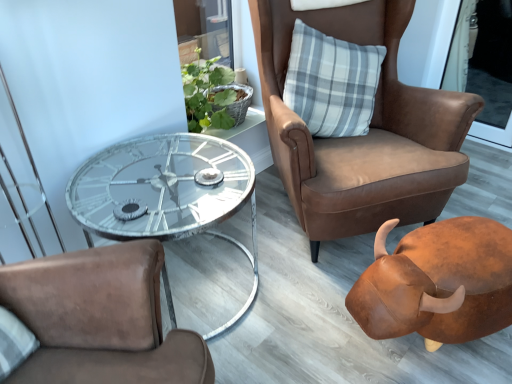
The image size is (512, 384). Describe the element at coordinates (364, 136) in the screenshot. I see `brown leather chair at upper right` at that location.

The height and width of the screenshot is (384, 512). In order to click on gray plaid pillow at upper right in this screenshot , I will do `click(332, 82)`.

Identify the location of transparent plastic screen door at upper right. Image resolution: width=512 pixels, height=384 pixels. (461, 48).

Which point is more distant from viewer, (195, 136) or (456, 90)?

The point (456, 90) is farther from the camera.

From a real-world perspective, between metallic glass coffee table at center and transparent plastic screen door at upper right, who is vertically higher?

In real-world perspective, transparent plastic screen door at upper right is above.

Does metallic glass coffee table at center turn towards transparent plastic screen door at upper right?

No, metallic glass coffee table at center is not turned towards transparent plastic screen door at upper right.

Which is behind, point (387, 332) or point (254, 280)?

The point (254, 280) is farther.

Locate an element on the screen. The height and width of the screenshot is (384, 512). piggy bank that is under the metallic glass coffee table at center (from a real-world perspective) is located at coordinates (437, 283).

Does brown leather piggy bank at lower right appear on the right side of metallic glass coffee table at center?

Correct, you'll find brown leather piggy bank at lower right to the right of metallic glass coffee table at center.

Is brown leather piggy bank at lower right positioned behind metallic glass coffee table at center?

Yes, it is.

Who is bigger, brown leather chair at upper right or gray plaid pillow at upper right?

Bigger between the two is brown leather chair at upper right.

Are brown leather chair at upper right and gray plaid pillow at upper right making contact?

No, brown leather chair at upper right is not making contact with gray plaid pillow at upper right.

Considering the relative positions of brown leather chair at upper right and gray plaid pillow at upper right in the image provided, is brown leather chair at upper right behind gray plaid pillow at upper right?

No.

Looking at their sizes, would you say brown leather chair at upper right is wider or thinner than gray plaid pillow at upper right?

Considering their sizes, brown leather chair at upper right looks broader than gray plaid pillow at upper right.

Image resolution: width=512 pixels, height=384 pixels. What are the coordinates of `screen door behind the metallic glass coffee table at center` in the screenshot? It's located at coord(461,48).

Can you tell me how much transparent plastic screen door at upper right and metallic glass coffee table at center differ in facing direction?

There is a 89.5-degree angle between the facing directions of transparent plastic screen door at upper right and metallic glass coffee table at center.

Which is behind, point (462, 11) or point (97, 225)?

Positioned behind is point (462, 11).

Is transparent plastic screen door at upper right behind metallic glass coffee table at center?

Yes, transparent plastic screen door at upper right is further from the viewer.

Considering the positions of objects gray plaid pillow at upper right and brown leather chair at upper right in the image provided, who is more to the right, gray plaid pillow at upper right or brown leather chair at upper right?

Positioned to the right is brown leather chair at upper right.

Would you say gray plaid pillow at upper right is a long distance from brown leather chair at upper right?

No, there isn't a large distance between gray plaid pillow at upper right and brown leather chair at upper right.

Is point (312, 120) closer or farther from the camera than point (355, 169)?

Clearly, point (312, 120) is more distant from the camera than point (355, 169).

In terms of height, does gray plaid pillow at upper right look taller or shorter compared to brown leather chair at upper right?

In the image, gray plaid pillow at upper right appears to be shorter than brown leather chair at upper right.

Between brown leather piggy bank at lower right and gray plaid pillow at upper right, which one has less height?

brown leather piggy bank at lower right is shorter.

From the picture: Considering the relative sizes of brown leather piggy bank at lower right and gray plaid pillow at upper right in the image provided, is brown leather piggy bank at lower right smaller than gray plaid pillow at upper right?

Yes.

Is point (419, 234) closer or farther from the camera than point (375, 56)?

Point (419, 234) is positioned closer to the camera compared to point (375, 56).

Looking at this image, is brown leather piggy bank at lower right placed right next to gray plaid pillow at upper right?

No, brown leather piggy bank at lower right is not with gray plaid pillow at upper right.

Is brown leather chair at upper right looking in the opposite direction of metallic glass coffee table at center?

No.

What are the coordinates of `chair on the right of metallic glass coffee table at center` in the screenshot? It's located at pos(364,136).

Which is closer to the camera, (328, 187) or (136, 222)?

The point (136, 222) is more forward.

Is brown leather chair at upper right positioned beyond the bounds of metallic glass coffee table at center?

That's correct, brown leather chair at upper right is outside of metallic glass coffee table at center.

In order to click on coffee table that is below the transparent plastic screen door at upper right (from the image's perspective) in this screenshot , I will do `click(165, 193)`.

Where is `piggy bank behind the metallic glass coffee table at center`? The height and width of the screenshot is (384, 512). piggy bank behind the metallic glass coffee table at center is located at coordinates (437, 283).

Looking at the image, which one is located closer to metallic glass coffee table at center, brown leather chair at upper right or gray plaid pillow at upper right?

The object closer to metallic glass coffee table at center is brown leather chair at upper right.

When comparing their distances from brown leather chair at upper right, does brown leather piggy bank at lower right or transparent plastic screen door at upper right seem further?

The object further to brown leather chair at upper right is transparent plastic screen door at upper right.

Based on their spatial positions, is metallic glass coffee table at center or brown leather piggy bank at lower right closer to gray plaid pillow at upper right?

The object closer to gray plaid pillow at upper right is metallic glass coffee table at center.

Which object lies nearer to the anchor point brown leather chair at upper right, metallic glass coffee table at center or brown leather piggy bank at lower right?

The object closer to brown leather chair at upper right is brown leather piggy bank at lower right.

From the image, which object appears to be nearer to transparent plastic screen door at upper right, metallic glass coffee table at center or brown leather piggy bank at lower right?

Based on the image, brown leather piggy bank at lower right appears to be nearer to transparent plastic screen door at upper right.

When comparing their distances from brown leather chair at upper right, does metallic glass coffee table at center or gray plaid pillow at upper right seem further?

metallic glass coffee table at center is positioned further to the anchor brown leather chair at upper right.

Looking at this image, estimate the real-world distances between objects in this image. Which object is closer to metallic glass coffee table at center, gray plaid pillow at upper right or transparent plastic screen door at upper right?

Based on the image, gray plaid pillow at upper right appears to be nearer to metallic glass coffee table at center.

From the image, which object appears to be nearer to brown leather piggy bank at lower right, gray plaid pillow at upper right or transparent plastic screen door at upper right?

Based on the image, gray plaid pillow at upper right appears to be nearer to brown leather piggy bank at lower right.

At what (x,y) coordinates should I click in order to perform the action: click on piggy bank between metallic glass coffee table at center and transparent plastic screen door at upper right from left to right. Please return your answer as a coordinate pair (x, y). This screenshot has width=512, height=384. Looking at the image, I should click on (x=437, y=283).

The image size is (512, 384). In order to click on pillow between metallic glass coffee table at center and transparent plastic screen door at upper right from left to right in this screenshot , I will do `click(332, 82)`.

At what (x,y) coordinates should I click in order to perform the action: click on chair that lies between gray plaid pillow at upper right and brown leather piggy bank at lower right from top to bottom. Please return your answer as a coordinate pair (x, y). This screenshot has width=512, height=384. Looking at the image, I should click on (364, 136).

Locate an element on the screen. pillow situated between metallic glass coffee table at center and brown leather piggy bank at lower right from left to right is located at coordinates (332, 82).